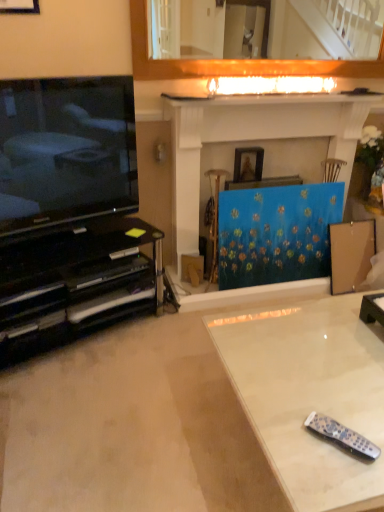
Question: Is black plastic remote at lower right shorter than wooden picture frame at center, which is the 2th picture frame in left-to-right order?

Choices:
 (A) no
 (B) yes

Answer: (B)

Question: From a real-world perspective, is black plastic remote at lower right over wooden picture frame at center, arranged as the 1th picture frame when ordered from the bottom?

Choices:
 (A) yes
 (B) no

Answer: (B)

Question: Is black plastic remote at lower right located outside wooden picture frame at center, which is counted as the 1th picture frame, starting from the back?

Choices:
 (A) yes
 (B) no

Answer: (A)

Question: Is the depth of black plastic remote at lower right greater than that of wooden picture frame at center, the 1th picture frame from the right?

Choices:
 (A) no
 (B) yes

Answer: (A)

Question: Is black plastic remote at lower right oriented towards wooden picture frame at center, arranged as the 1th picture frame when ordered from the bottom?

Choices:
 (A) no
 (B) yes

Answer: (A)

Question: Is the surface of black plastic remote at lower right in direct contact with wooden picture frame at center, arranged as the 1th picture frame when ordered from the bottom?

Choices:
 (A) yes
 (B) no

Answer: (B)

Question: Is wooden picture frame at upper left, acting as the 2th picture frame starting from the back, smaller than matte black television at left?

Choices:
 (A) yes
 (B) no

Answer: (A)

Question: Does wooden picture frame at upper left, which is counted as the first picture frame, starting from the front, have a lesser width compared to matte black television at left?

Choices:
 (A) no
 (B) yes

Answer: (B)

Question: Considering the relative sizes of wooden picture frame at upper left, acting as the 2th picture frame starting from the back, and matte black television at left in the image provided, is wooden picture frame at upper left, acting as the 2th picture frame starting from the back, wider than matte black television at left?

Choices:
 (A) no
 (B) yes

Answer: (A)

Question: Is matte black television at left surrounded by wooden picture frame at upper left, the second picture frame in the right-to-left sequence?

Choices:
 (A) yes
 (B) no

Answer: (B)

Question: Is wooden picture frame at upper left, positioned as the first picture frame in top-to-bottom order, next to matte black television at left and touching it?

Choices:
 (A) yes
 (B) no

Answer: (B)

Question: Considering the relative positions of wooden picture frame at upper left, the 2th picture frame from the bottom, and matte black television at left in the image provided, is wooden picture frame at upper left, the 2th picture frame from the bottom, to the right of matte black television at left from the viewer's perspective?

Choices:
 (A) yes
 (B) no

Answer: (B)

Question: Is wooden picture frame at upper left, acting as the 2th picture frame starting from the back, closer to camera compared to blue textured fabric at center?

Choices:
 (A) no
 (B) yes

Answer: (B)